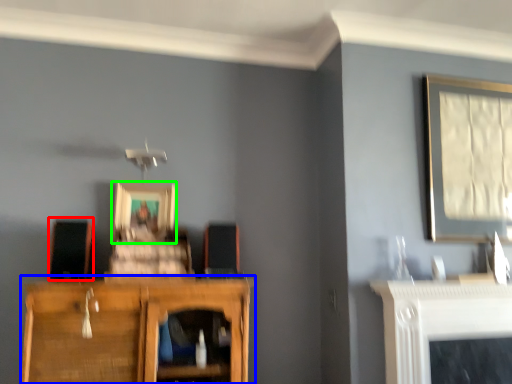
Question: Based on their relative distances, which object is farther from speaker (highlighted by a red box)? Choose from cupboard (highlighted by a blue box) and picture frame (highlighted by a green box).

Choices:
 (A) cupboard
 (B) picture frame

Answer: (A)